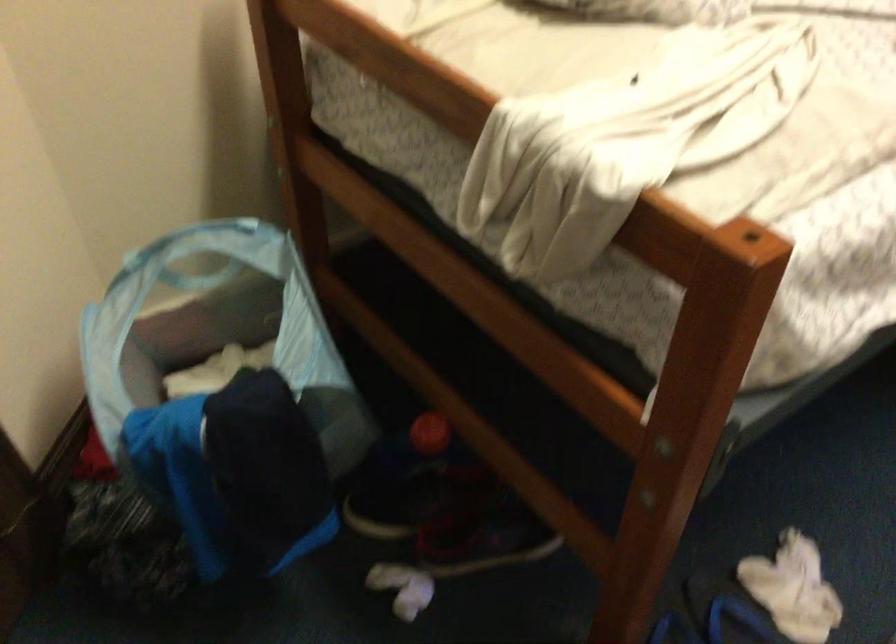
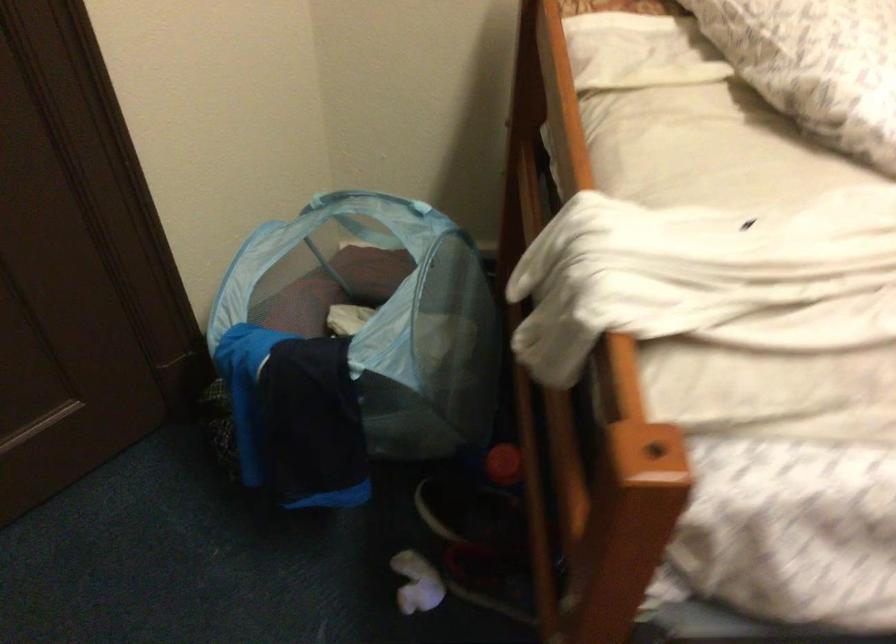
In the second image, find the point that corresponds to (x=276, y=374) in the first image.

(354, 345)